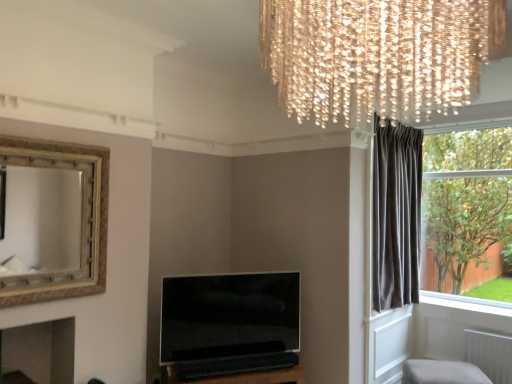
Question: Should I look upward or downward to see gold textured mirror at upper left?

Choices:
 (A) up
 (B) down

Answer: (B)

Question: Is flat-screen tv at center in front of light beige fabric ottoman at lower right?

Choices:
 (A) no
 (B) yes

Answer: (B)

Question: Considering the relative sizes of flat-screen tv at center and light beige fabric ottoman at lower right in the image provided, is flat-screen tv at center shorter than light beige fabric ottoman at lower right?

Choices:
 (A) no
 (B) yes

Answer: (A)

Question: Is flat-screen tv at center smaller than light beige fabric ottoman at lower right?

Choices:
 (A) yes
 (B) no

Answer: (B)

Question: Is flat-screen tv at center bigger than light beige fabric ottoman at lower right?

Choices:
 (A) yes
 (B) no

Answer: (A)

Question: Is flat-screen tv at center with light beige fabric ottoman at lower right?

Choices:
 (A) no
 (B) yes

Answer: (A)

Question: From a real-world perspective, is flat-screen tv at center on light beige fabric ottoman at lower right?

Choices:
 (A) yes
 (B) no

Answer: (A)

Question: Can you confirm if flat-screen tv at center is shorter than dark velvet curtain at right?

Choices:
 (A) no
 (B) yes

Answer: (B)

Question: Can you confirm if flat-screen tv at center is smaller than dark velvet curtain at right?

Choices:
 (A) no
 (B) yes

Answer: (B)

Question: Is flat-screen tv at center outside of dark velvet curtain at right?

Choices:
 (A) yes
 (B) no

Answer: (A)

Question: Is flat-screen tv at center thinner than dark velvet curtain at right?

Choices:
 (A) yes
 (B) no

Answer: (B)

Question: Is flat-screen tv at center next to dark velvet curtain at right?

Choices:
 (A) no
 (B) yes

Answer: (A)

Question: Can you confirm if flat-screen tv at center is bigger than dark velvet curtain at right?

Choices:
 (A) no
 (B) yes

Answer: (A)

Question: Is gold textured mirror at upper left completely or partially outside of crystal chandelier at upper center?

Choices:
 (A) yes
 (B) no

Answer: (A)